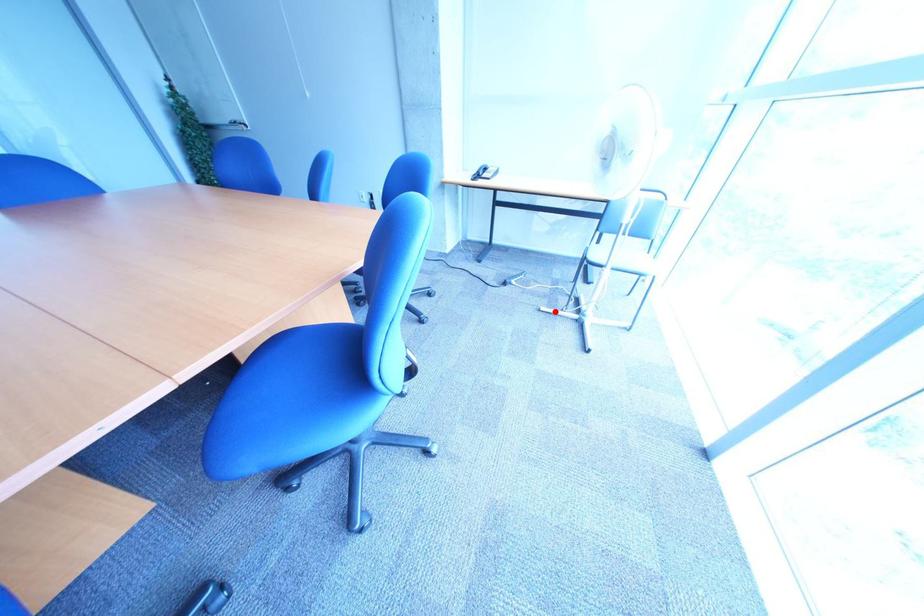
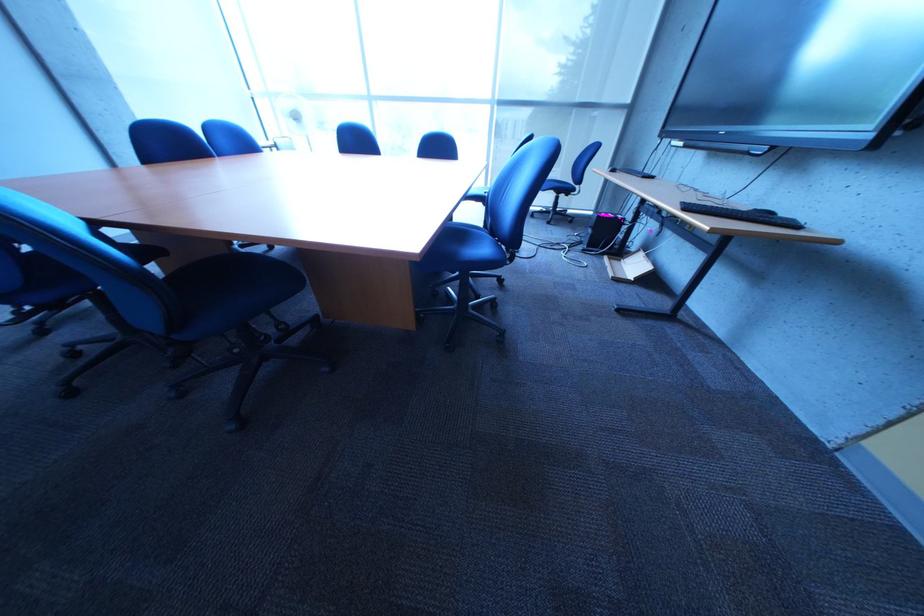
Question: I am providing you with two images of the same scene from different viewpoints. A red point is marked on the first image. At the location where the point appears in image 1, is it still visible in image 2?

Choices:
 (A) Yes
 (B) No

Answer: (B)